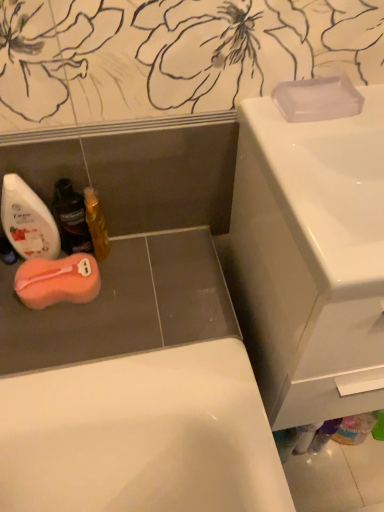
Find the location of `free location in front of transparent plastic soap at upper right, placed as the 2th soap when sorted from bottom to top`. free location in front of transparent plastic soap at upper right, placed as the 2th soap when sorted from bottom to top is located at coordinates (314, 138).